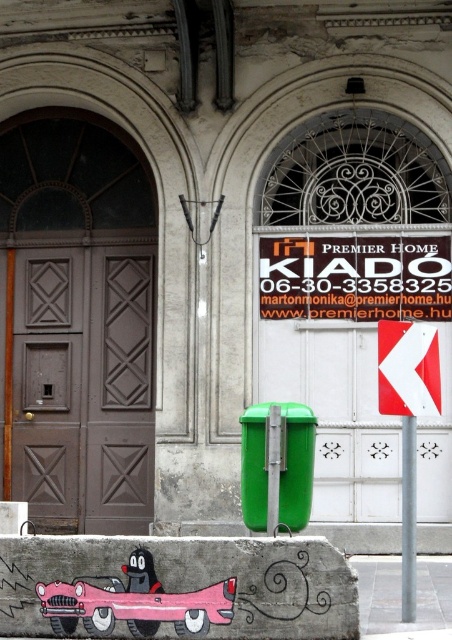
Does pink matte toy car at lower left have a smaller size compared to white reflective arrow at center right?

No.

Which is behind, point (74, 582) or point (394, 342)?

The point (394, 342) is behind.

Image resolution: width=452 pixels, height=640 pixels. I want to click on pink matte toy car at lower left, so click(135, 602).

Can you confirm if white plastic sign at upper center is bigger than pink matte toy car at lower left?

Indeed, white plastic sign at upper center has a larger size compared to pink matte toy car at lower left.

Does point (281, 317) come behind point (178, 602)?

Yes, it is behind point (178, 602).

What are the coordinates of `white plastic sign at upper center` in the screenshot? It's located at (354, 276).

Can you confirm if white plastic sign at upper center is positioned below white reflective arrow at center right?

No, white plastic sign at upper center is not below white reflective arrow at center right.

What do you see at coordinates (354, 276) in the screenshot? I see `white plastic sign at upper center` at bounding box center [354, 276].

Describe the element at coordinates (354, 276) in the screenshot. I see `white plastic sign at upper center` at that location.

The image size is (452, 640). What are the coordinates of `white plastic sign at upper center` in the screenshot? It's located at (354, 276).